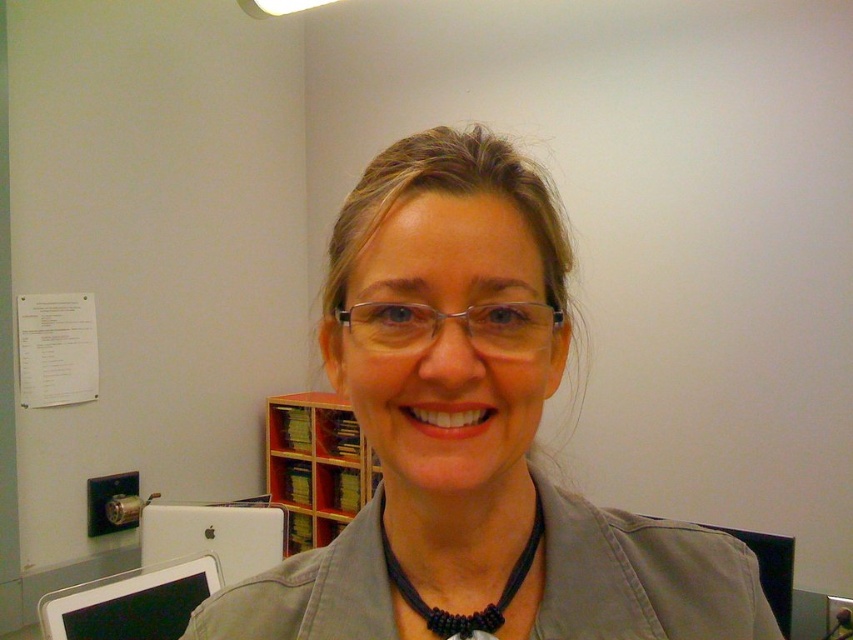
Does black glossy tablet at lower left have a larger size compared to white matte tablet at lower left?

Incorrect, black glossy tablet at lower left is not larger than white matte tablet at lower left.

Does point (167, 624) come closer to viewer compared to point (202, 525)?

Yes, it is.

Find the location of a particular element. The height and width of the screenshot is (640, 853). black glossy tablet at lower left is located at coordinates (131, 602).

Which is behind, point (368, 173) or point (238, 522)?

Point (238, 522)

Consider the image. Does matte gray jacket at center come in front of white matte tablet at lower left?

Yes, it is in front of white matte tablet at lower left.

Describe the element at coordinates (473, 436) in the screenshot. This screenshot has height=640, width=853. I see `matte gray jacket at center` at that location.

Locate an element on the screen. This screenshot has height=640, width=853. matte gray jacket at center is located at coordinates (473, 436).

Is point (86, 612) closer to camera compared to point (474, 628)?

No, (86, 612) is behind (474, 628).

Who is higher up, black glossy tablet at lower left or black beaded necklace at center?

black beaded necklace at center

Describe the element at coordinates (131, 602) in the screenshot. Image resolution: width=853 pixels, height=640 pixels. I see `black glossy tablet at lower left` at that location.

This screenshot has height=640, width=853. I want to click on black glossy tablet at lower left, so click(131, 602).